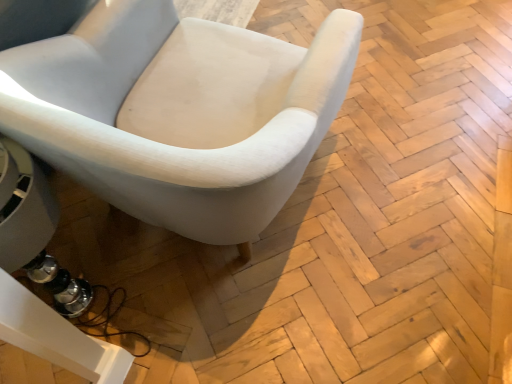
What do you see at coordinates (173, 143) in the screenshot? I see `white fabric chair at center` at bounding box center [173, 143].

Find the location of a particular element. The width and height of the screenshot is (512, 384). white fabric chair at center is located at coordinates tap(173, 143).

Where is `white fabric chair at center`? The height and width of the screenshot is (384, 512). white fabric chair at center is located at coordinates (173, 143).